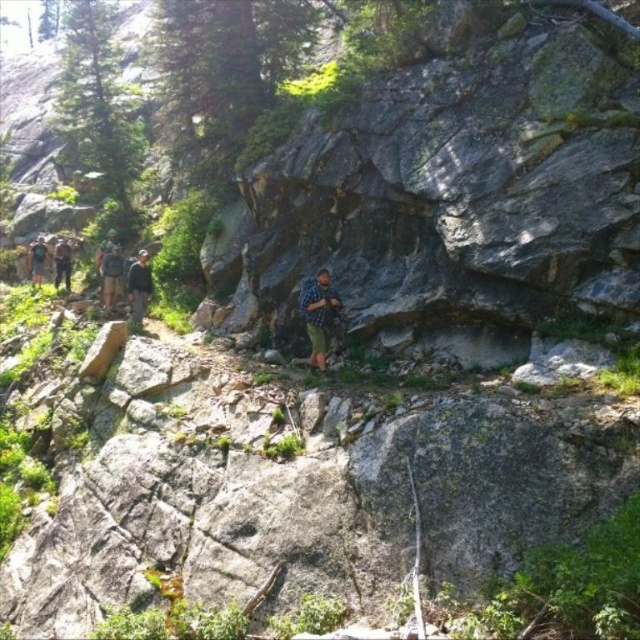
Question: Is dark gray backpack at center thinner than camouflage fabric backpack at left?

Choices:
 (A) yes
 (B) no

Answer: (B)

Question: Which object appears closest to the camera in this image?

Choices:
 (A) camouflage fabric backpack at left
 (B) blue plaid shirt at center

Answer: (B)

Question: Which point is closer to the camera taking this photo?

Choices:
 (A) (102, 248)
 (B) (300, 310)
 (C) (100, 269)
 (D) (44, 252)

Answer: (B)

Question: Is blue plaid shirt at center closer to the viewer compared to green fabric backpack at left?

Choices:
 (A) yes
 (B) no

Answer: (A)

Question: Which object is the farthest from the camouflage fabric backpack at left?

Choices:
 (A) blue plaid shirt at center
 (B) camouflage backpack at left

Answer: (A)

Question: Is gray rough rock at center above camouflage backpack at left?

Choices:
 (A) no
 (B) yes

Answer: (B)